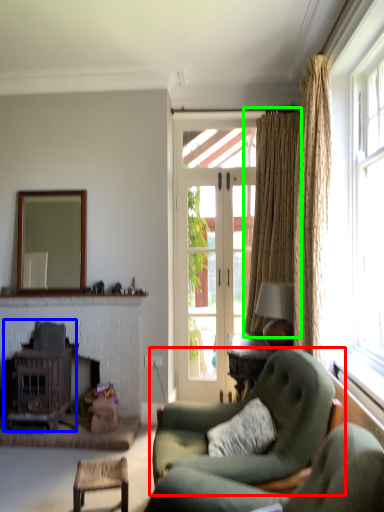
Question: Which object is positioned closest to chair (highlighted by a red box)? Select from stove (highlighted by a blue box) and curtain (highlighted by a green box).

Choices:
 (A) stove
 (B) curtain

Answer: (A)